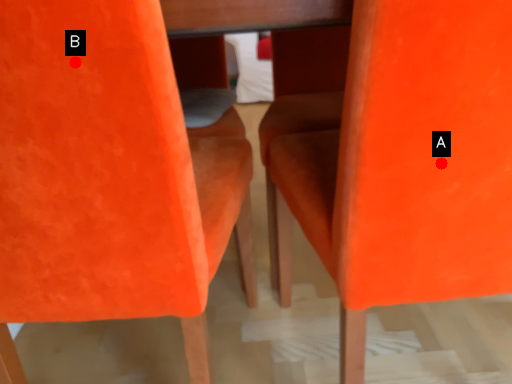
Question: Two points are circled on the image, labeled by A and B beside each circle. Which of the following is the closest to the observer?

Choices:
 (A) A is closer
 (B) B is closer

Answer: (B)